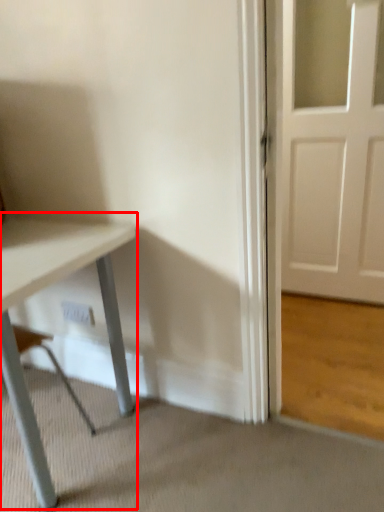
Question: Where is table (annotated by the red box) located in relation to electric outlet in the image?

Choices:
 (A) left
 (B) right

Answer: (A)